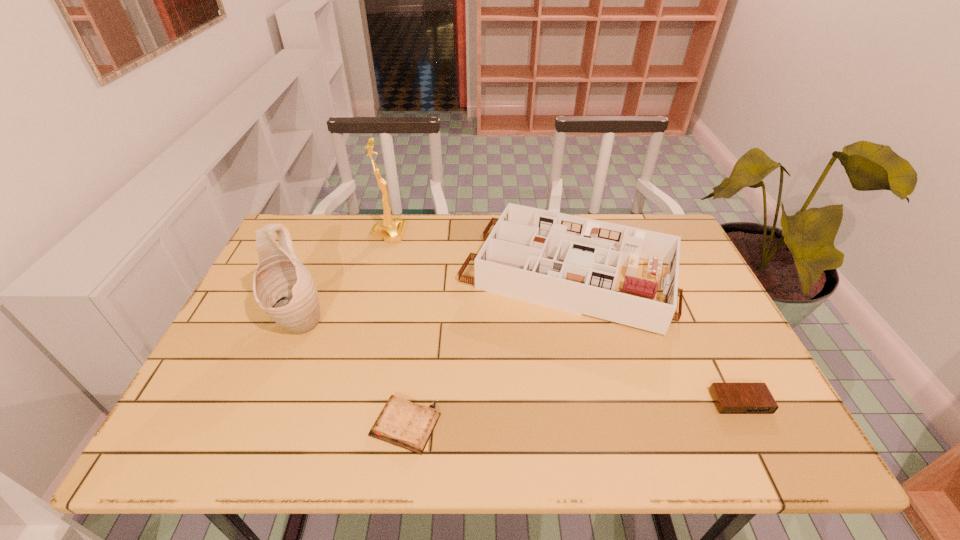
Where is `award`? The image size is (960, 540). award is located at coordinates click(x=391, y=230).

Identify the location of the leftmost object. This screenshot has height=540, width=960. (283, 287).

I want to click on the third tallest object, so click(569, 263).

At what (x,y) coordinates should I click in order to perform the action: click on alarm clock. Please return your answer as a coordinate pair (x, y). Image resolution: width=960 pixels, height=540 pixels. Looking at the image, I should click on (730, 398).

At what (x,y) coordinates should I click in order to perform the action: click on the shortest object. Please return your answer as a coordinate pair (x, y). The width and height of the screenshot is (960, 540). Looking at the image, I should click on (402, 423).

Locate an element on the screen. This screenshot has width=960, height=540. diary is located at coordinates (402, 423).

The height and width of the screenshot is (540, 960). I want to click on vacant region located on the front-facing side of the award, so click(x=483, y=233).

Find the location of a particular element. The image size is (960, 540). vacant space located at the spout of the leftmost object is located at coordinates (282, 364).

At what (x,y) coordinates should I click in order to perform the action: click on vacant space located 0.080m on the front of the third shortest object. Please return your answer as a coordinate pair (x, y). Looking at the image, I should click on (587, 363).

Where is `free space located 0.060m on the front face of the second shortest object`? The height and width of the screenshot is (540, 960). free space located 0.060m on the front face of the second shortest object is located at coordinates (759, 441).